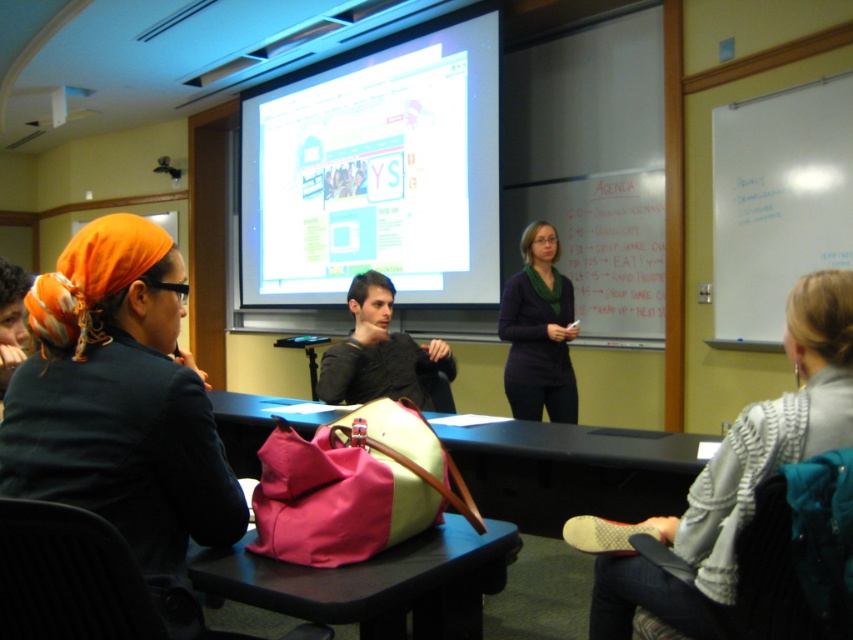
Does point (488, 173) come farther from viewer compared to point (654, 524)?

Yes, point (488, 173) is behind point (654, 524).

Which is behind, point (375, 228) or point (703, 595)?

The point (375, 228) is behind.

This screenshot has width=853, height=640. What do you see at coordinates (376, 173) in the screenshot? I see `matte white projector screen at upper center` at bounding box center [376, 173].

This screenshot has width=853, height=640. I want to click on matte white projector screen at upper center, so click(x=376, y=173).

Is point (821, 412) in front of point (560, 300)?

Yes.

In the scene shown: Between striped sweater at lower right and dark purple sweater at center, which one appears on the right side from the viewer's perspective?

Positioned to the right is striped sweater at lower right.

What are the coordinates of `striped sweater at lower right` in the screenshot? It's located at (730, 477).

This screenshot has width=853, height=640. I want to click on striped sweater at lower right, so click(730, 477).

Can you confirm if striped sweater at lower right is positioned below white plastic projector at upper left?

Yes, striped sweater at lower right is below white plastic projector at upper left.

Does striped sweater at lower right have a larger size compared to white plastic projector at upper left?

Yes, striped sweater at lower right is bigger than white plastic projector at upper left.

Is point (705, 468) farther from camera compared to point (61, 120)?

No, (705, 468) is in front of (61, 120).

I want to click on striped sweater at lower right, so click(730, 477).